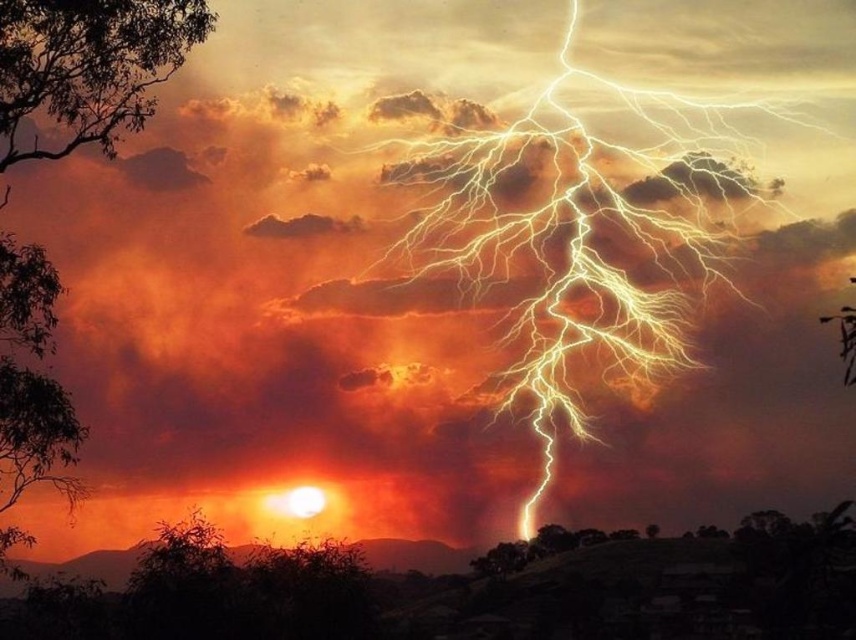
Question: Does green leafy tree at upper left appear under green leafy tree at left?

Choices:
 (A) no
 (B) yes

Answer: (A)

Question: Which point is closer to the camera taking this photo?

Choices:
 (A) (36, 403)
 (B) (116, 72)
 (C) (40, 328)

Answer: (B)

Question: Which point is farther from the camera taking this photo?

Choices:
 (A) (176, 1)
 (B) (21, 292)
 (C) (15, 541)

Answer: (C)

Question: Estimate the real-world distances between objects in this image. Which object is farther from the silhouette bark tree at left?

Choices:
 (A) green leafy tree at upper left
 (B) green leafy tree at left

Answer: (A)

Question: Does green leafy tree at upper left appear on the left side of green leafy tree at left?

Choices:
 (A) yes
 (B) no

Answer: (B)

Question: Is silhouette bark tree at left positioned behind green leafy tree at left?

Choices:
 (A) yes
 (B) no

Answer: (B)